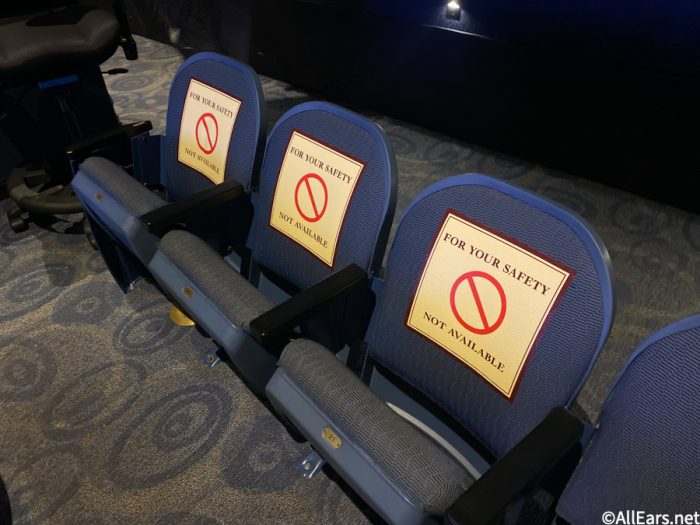
Where is `cushion`? cushion is located at coordinates (374, 407).